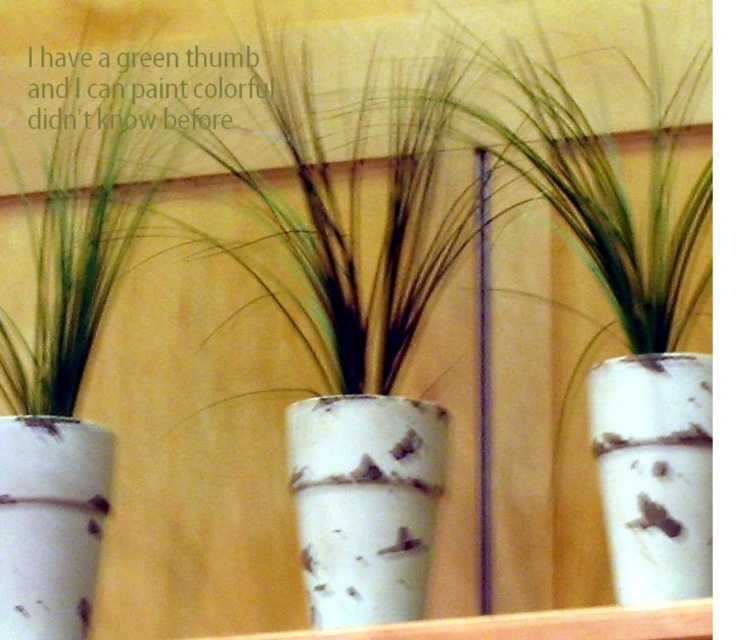
Question: Is white speckled vase at center bigger than white textured vase at left?

Choices:
 (A) no
 (B) yes

Answer: (B)

Question: Is white speckled vase at center to the left of white textured vase at center from the viewer's perspective?

Choices:
 (A) yes
 (B) no

Answer: (A)

Question: Considering the real-world distances, which object is farthest from the green leafy plant at center?

Choices:
 (A) white textured vase at center
 (B) white textured vase at left
 (C) white speckled vase at center

Answer: (A)

Question: Which of the following is the closest to the observer?

Choices:
 (A) green leafy plant at center
 (B) white textured vase at center
 (C) white textured vase at left
 (D) white speckled vase at center

Answer: (B)

Question: Is white textured vase at center below white textured vase at left?

Choices:
 (A) no
 (B) yes

Answer: (A)

Question: Which point is farther from the camera taking this photo?

Choices:
 (A) (654, 392)
 (B) (328, 509)
 (C) (61, 227)
 (D) (58, 492)

Answer: (C)